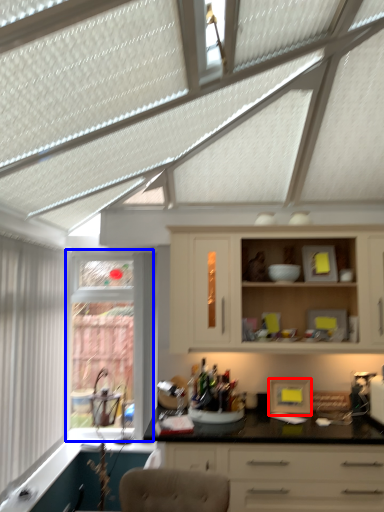
Question: Which point is further to the camera, appliance (highlighted by a red box) or window (highlighted by a blue box)?

Choices:
 (A) appliance
 (B) window

Answer: (B)